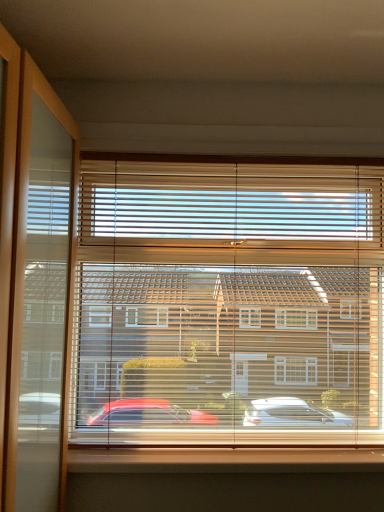
Question: Is wooden blinds at center surrounded by smooth wood window sill at lower center?

Choices:
 (A) no
 (B) yes

Answer: (A)

Question: Considering the relative positions of smooth wood window sill at lower center and wooden blinds at center in the image provided, is smooth wood window sill at lower center to the right of wooden blinds at center from the viewer's perspective?

Choices:
 (A) no
 (B) yes

Answer: (A)

Question: From a real-world perspective, is smooth wood window sill at lower center located beneath wooden blinds at center?

Choices:
 (A) yes
 (B) no

Answer: (A)

Question: Can you see smooth wood window sill at lower center touching wooden blinds at center?

Choices:
 (A) yes
 (B) no

Answer: (B)

Question: Is smooth wood window sill at lower center further to the viewer compared to wooden blinds at center?

Choices:
 (A) yes
 (B) no

Answer: (B)

Question: Is smooth wood window sill at lower center completely or partially outside of wooden blinds at center?

Choices:
 (A) no
 (B) yes

Answer: (A)

Question: Is wooden blinds at center positioned before smooth wood window sill at lower center?

Choices:
 (A) yes
 (B) no

Answer: (B)

Question: Can we say wooden blinds at center lies outside smooth wood window sill at lower center?

Choices:
 (A) yes
 (B) no

Answer: (A)

Question: Is smooth wood window sill at lower center inside wooden blinds at center?

Choices:
 (A) yes
 (B) no

Answer: (A)

Question: Is wooden blinds at center further to camera compared to smooth wood window sill at lower center?

Choices:
 (A) no
 (B) yes

Answer: (B)

Question: Can you confirm if wooden blinds at center is positioned to the left of smooth wood window sill at lower center?

Choices:
 (A) yes
 (B) no

Answer: (B)

Question: Is wooden blinds at center facing towards smooth wood window sill at lower center?

Choices:
 (A) yes
 (B) no

Answer: (A)

Question: Is wooden blinds at center taller or shorter than smooth wood window sill at lower center?

Choices:
 (A) tall
 (B) short

Answer: (A)